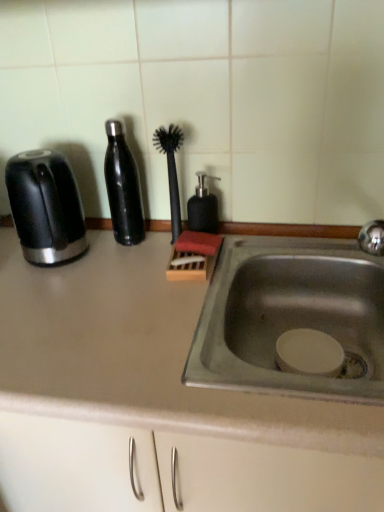
The width and height of the screenshot is (384, 512). Find the location of `free region on the left part of satin black bottle at center left`. free region on the left part of satin black bottle at center left is located at coordinates (79, 247).